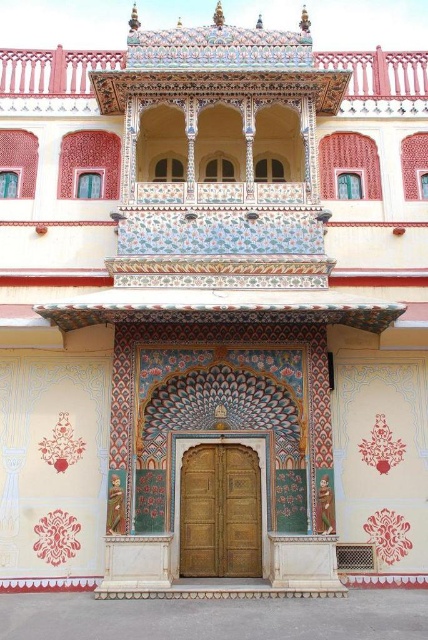
Question: Does polychrome painted balcony at upper center come behind golden wood door at center?

Choices:
 (A) yes
 (B) no

Answer: (A)

Question: Does polychrome painted balcony at upper center come in front of golden wood door at center?

Choices:
 (A) yes
 (B) no

Answer: (B)

Question: Which point is farther from the camera taking this photo?

Choices:
 (A) (56, 88)
 (B) (231, 561)

Answer: (A)

Question: Observing the image, what is the correct spatial positioning of polychrome painted balcony at upper center in reference to golden wood door at center?

Choices:
 (A) above
 (B) below

Answer: (A)

Question: Which object is closer to the camera taking this photo?

Choices:
 (A) polychrome painted balcony at upper center
 (B) golden wood door at center

Answer: (B)